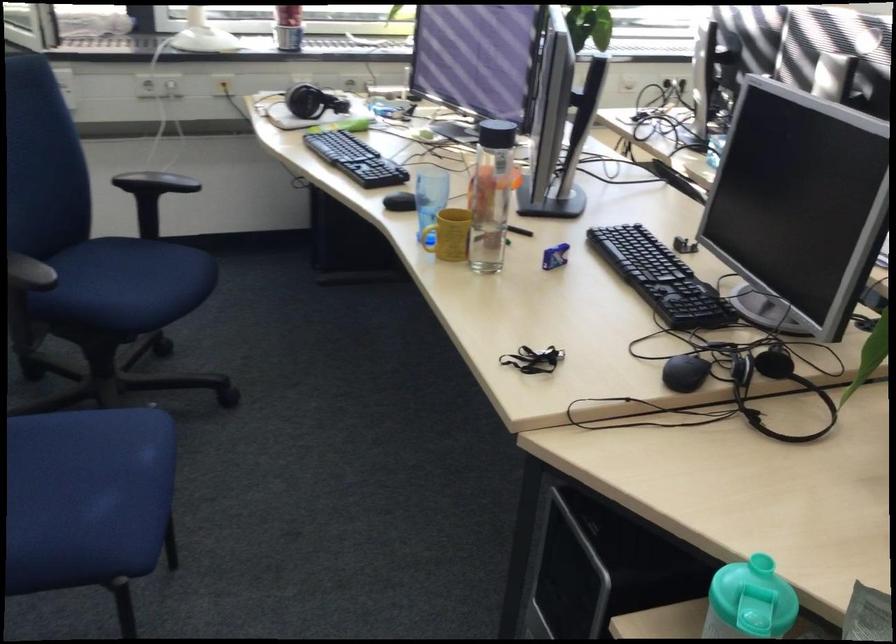
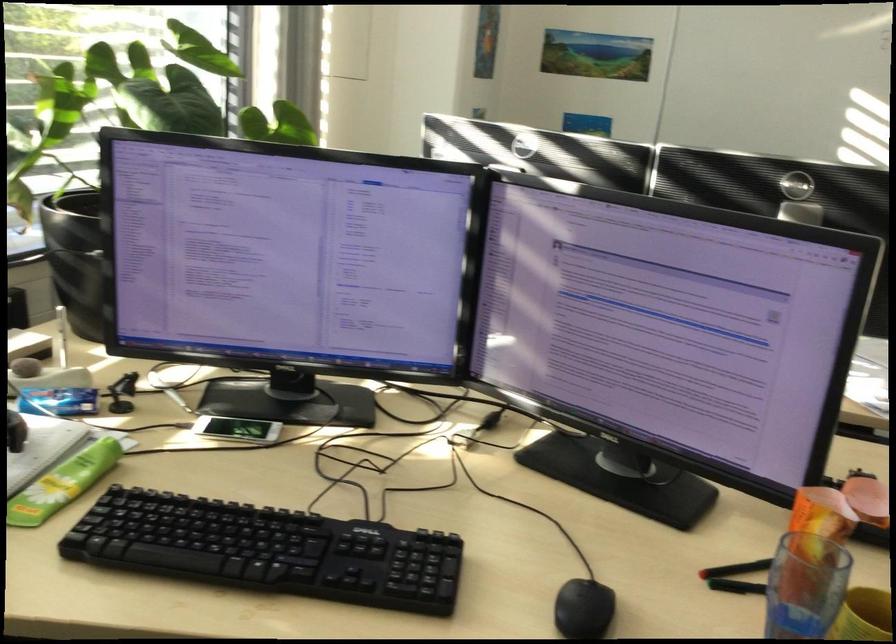
The point at [340,120] is marked in the first image. Where is the corresponding point in the second image?

(64, 483)